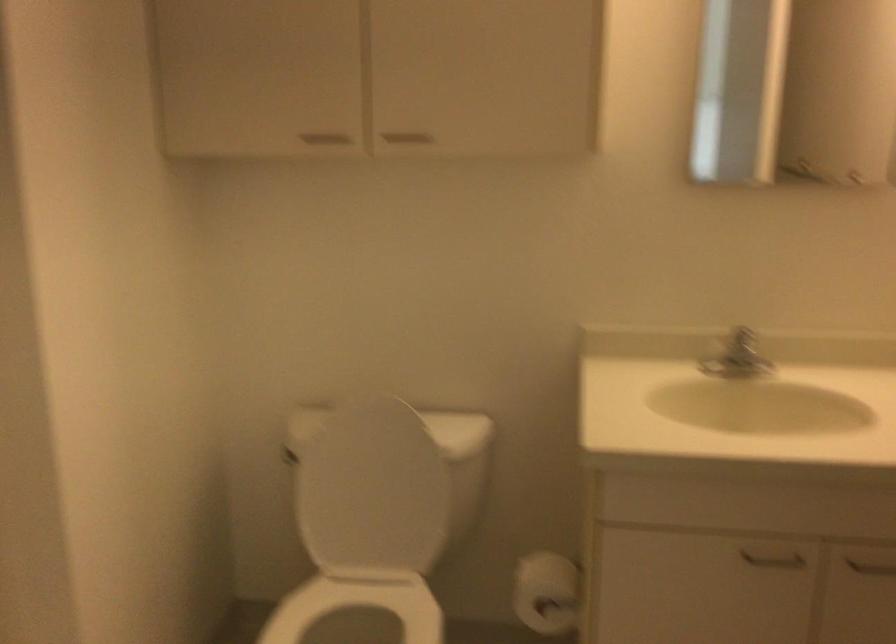
What do you see at coordinates (737, 357) in the screenshot? I see `the faucet handle` at bounding box center [737, 357].